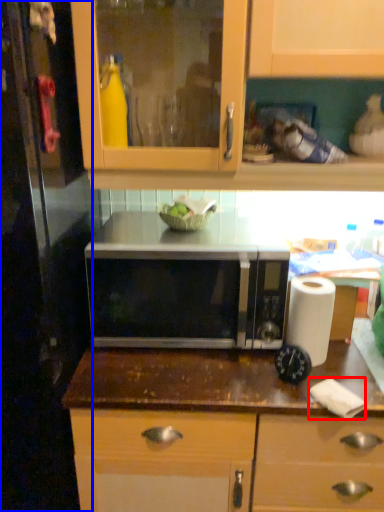
Question: Which of the following is the closest to the observer, toilet paper (highlighted by a red box) or glass door (highlighted by a blue box)?

Choices:
 (A) toilet paper
 (B) glass door

Answer: (B)